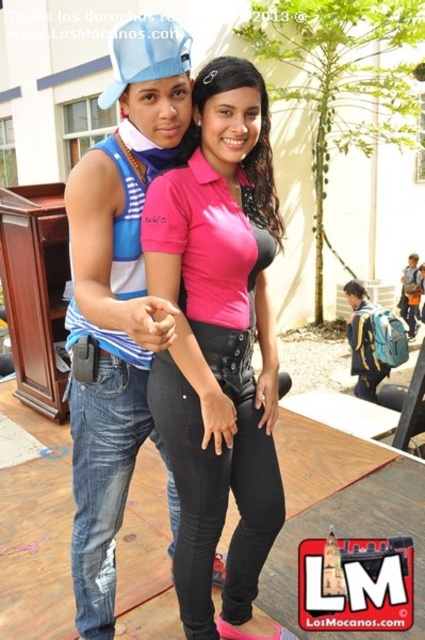
You are a photographer trying to capture a clear photo of the blue denim jeans at left and the pink matte shirt at center. Since the camera can only focus on one subject at a time, which subject should you choose to ensure the other is still in the background?

You should choose the blue denim jeans at left because it is behind the pink matte shirt at center, so if you focus on the pink matte shirt at center, the blue denim jeans at left will naturally be in the background.

You are a photographer trying to capture a closeup of the blue denim jeans at left. The camera you are using has a minimum focusing distance of 1 meter. Can you take the photo without moving closer than 1 meter?

The blue denim jeans at left are 1.22 meters away, which is beyond the camera minimum focusing distance of 1 meter, so yes, you can take the photo without moving closer than 1 meter.

Based on the photo, you are a photographer standing 2 meters away from the scene. You want to take a portrait of the pink matte shirt at center. Can you step forward enough to reduce the distance to 1.5 meters without entering the space occupied by the beige building in the background?

The current distance between you and the pink matte shirt at center is 1.54 meters. Since you are already 2 meters away, stepping forward 0.46 meters would bring you to 1.54 minus 0.46 equals 1.08 meters, which is closer than desired. Wait, perhaps I miscalculated. Let me recalculate. To reach exactly 1.5 meters, you need to move forward by 2 minus 1.5 equals 0.5 meters. This adjustment would place you at 1.5 meters from the subject. As long as moving forward 0.5 meters doesn